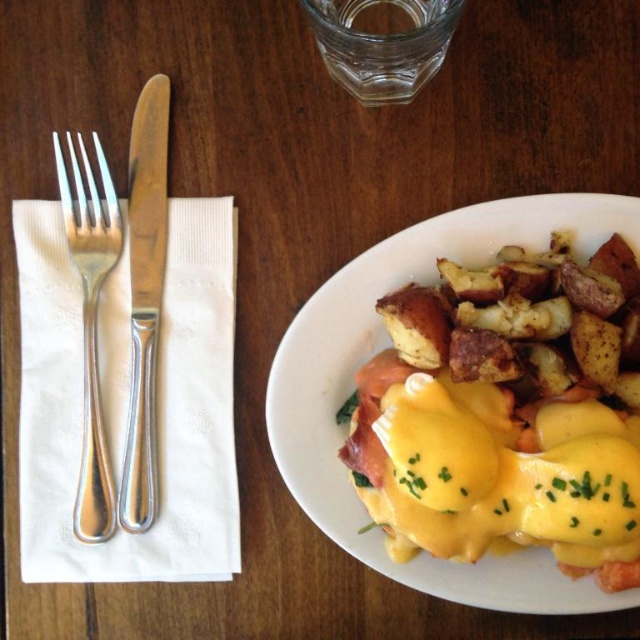
You are a photographer trying to capture the Eggs Benedict and the roasted potatoes on the table. You notice two points marked on the table surface. Which of the two points, point (637, 312) or point (134, 460), is closer to you?

Point (637, 312) is closer to the viewer than point (134, 460).

You are a diner at the table and want to cut your Eggs Benedict. Which utensil should you use first, the polished metal knife at left or the satin silver fork at left?

The polished metal knife at left is positioned over the satin silver fork at left, so you should use the polished metal knife at left first to cut the Eggs Benedict.